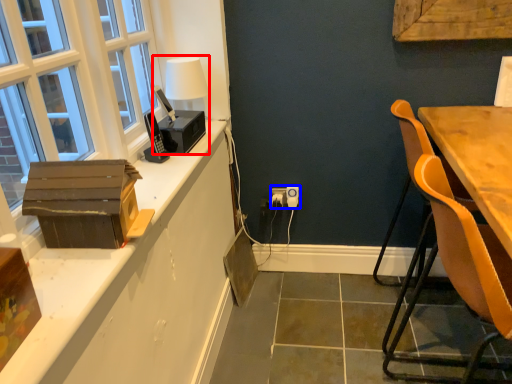
Question: Which of the following is the closest to the observer, table lamp (highlighted by a red box) or electric outlet (highlighted by a blue box)?

Choices:
 (A) table lamp
 (B) electric outlet

Answer: (A)